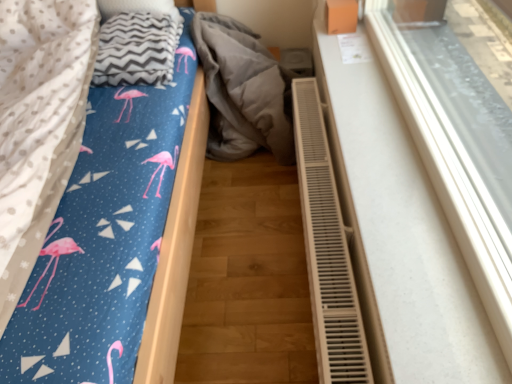
Question: From a real-world perspective, is white plastic radiator at right over flamingo-patterned fabric at left?

Choices:
 (A) yes
 (B) no

Answer: (A)

Question: Is white plastic radiator at right to the left of flamingo-patterned fabric at left from the viewer's perspective?

Choices:
 (A) no
 (B) yes

Answer: (A)

Question: Is white plastic radiator at right directly adjacent to flamingo-patterned fabric at left?

Choices:
 (A) no
 (B) yes

Answer: (A)

Question: From the image's perspective, is white plastic radiator at right located beneath flamingo-patterned fabric at left?

Choices:
 (A) no
 (B) yes

Answer: (B)

Question: Is white plastic radiator at right oriented towards flamingo-patterned fabric at left?

Choices:
 (A) yes
 (B) no

Answer: (A)

Question: Is flamingo-patterned fabric at left surrounded by white plastic radiator at right?

Choices:
 (A) yes
 (B) no

Answer: (B)

Question: Can you confirm if gray zigzag blanket at upper left is taller than white plastic radiator at lower right?

Choices:
 (A) no
 (B) yes

Answer: (A)

Question: From a real-world perspective, does gray zigzag blanket at upper left sit lower than white plastic radiator at lower right?

Choices:
 (A) yes
 (B) no

Answer: (B)

Question: Can you confirm if gray zigzag blanket at upper left is wider than white plastic radiator at lower right?

Choices:
 (A) yes
 (B) no

Answer: (A)

Question: From the image's perspective, is gray zigzag blanket at upper left above white plastic radiator at lower right?

Choices:
 (A) no
 (B) yes

Answer: (B)

Question: From a real-world perspective, is gray zigzag blanket at upper left on top of white plastic radiator at lower right?

Choices:
 (A) no
 (B) yes

Answer: (B)

Question: Would you say white plastic radiator at lower right is part of gray zigzag blanket at upper left's contents?

Choices:
 (A) no
 (B) yes

Answer: (A)

Question: Is white plastic radiator at right facing away from gray fabric at center?

Choices:
 (A) yes
 (B) no

Answer: (B)